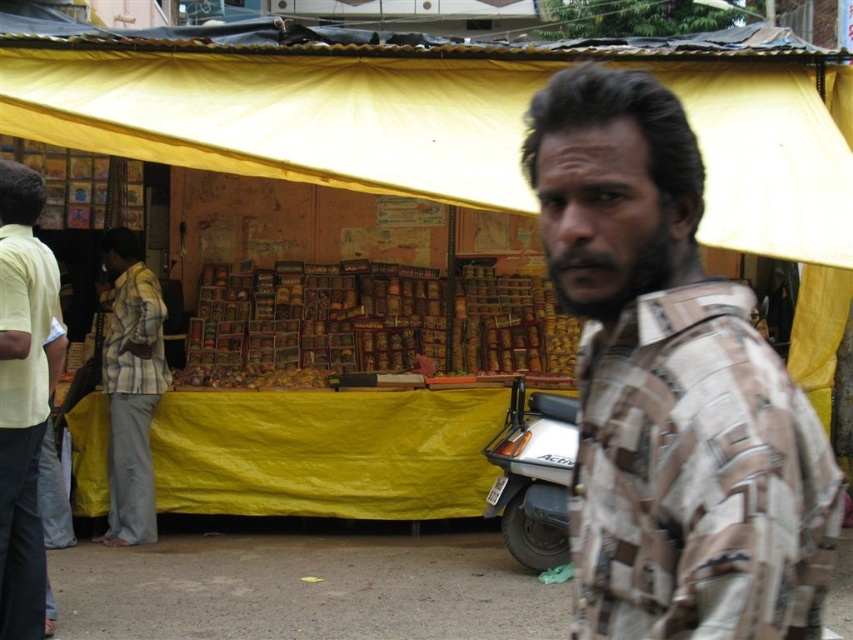
Question: Which of the following is the closest to the observer?

Choices:
 (A) (585, 248)
 (B) (13, 225)
 (C) (312, 88)
 (D) (120, 244)

Answer: (A)

Question: Is yellow fabric canopy at upper center above striped cotton shirt at left?

Choices:
 (A) no
 (B) yes

Answer: (B)

Question: Can you confirm if yellow fabric canopy at upper center is positioned above striped cotton shirt at left?

Choices:
 (A) yes
 (B) no

Answer: (A)

Question: Which object is positioned closest to the camouflage shirt at center?

Choices:
 (A) light yellow shirt at left
 (B) yellow fabric canopy at upper center
 (C) striped cotton shirt at left

Answer: (A)

Question: Can you confirm if camouflage shirt at center is positioned to the right of yellow fabric canopy at upper center?

Choices:
 (A) yes
 (B) no

Answer: (A)

Question: Which point appears farthest from the camera in this image?

Choices:
 (A) (44, 561)
 (B) (132, 410)
 (C) (744, 620)
 (D) (393, 129)

Answer: (B)